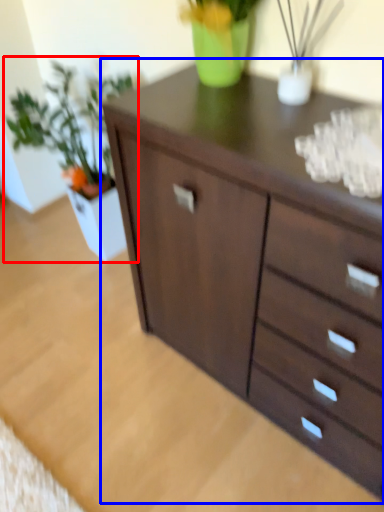
Question: Which point is further to the camera, houseplant (highlighted by a red box) or chest of drawers (highlighted by a blue box)?

Choices:
 (A) houseplant
 (B) chest of drawers

Answer: (A)